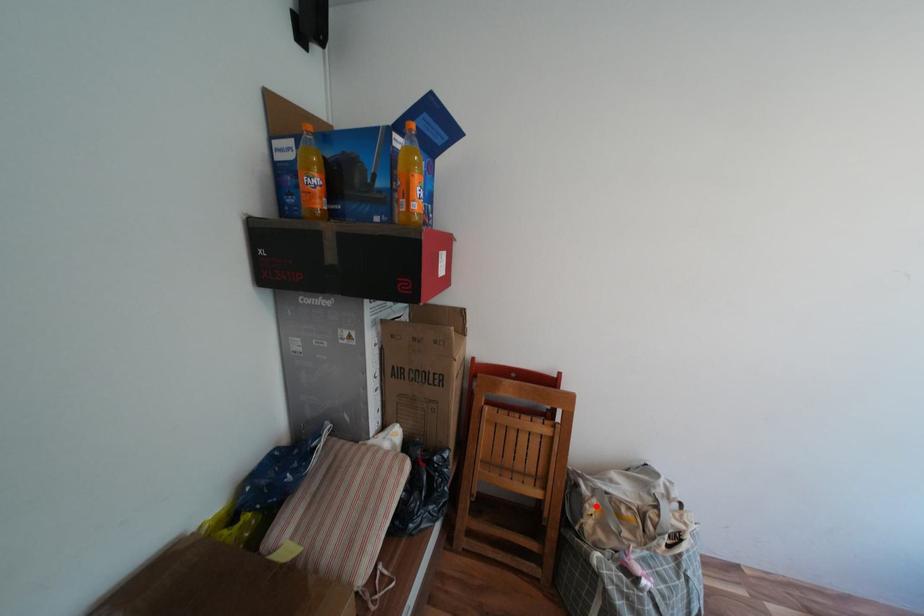
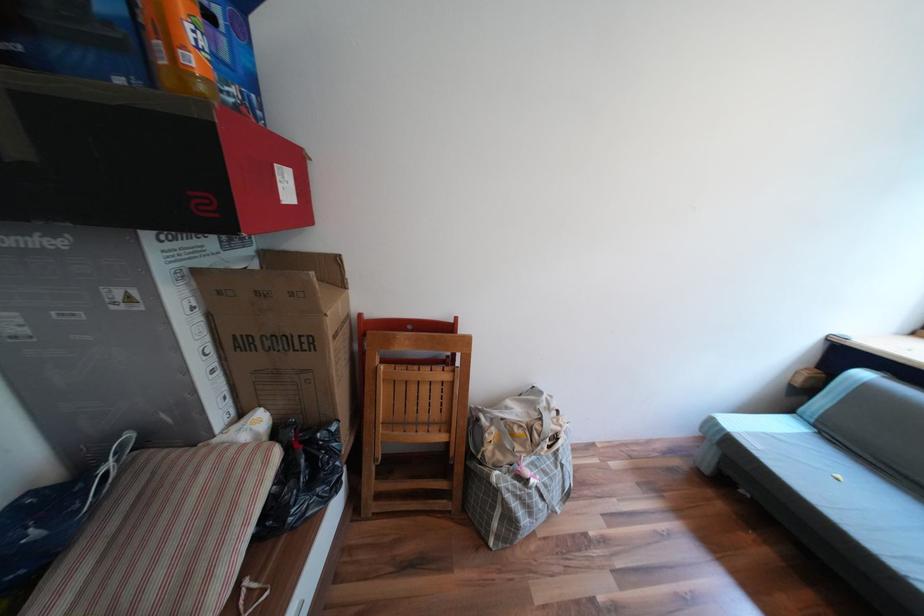
Question: A red point is marked in image1. In image2, is the corresponding 3D point closer to the camera or farther? Reply with the corresponding letter.

Choices:
 (A) The corresponding 3D point is closer.
 (B) The corresponding 3D point is farther.

Answer: (B)